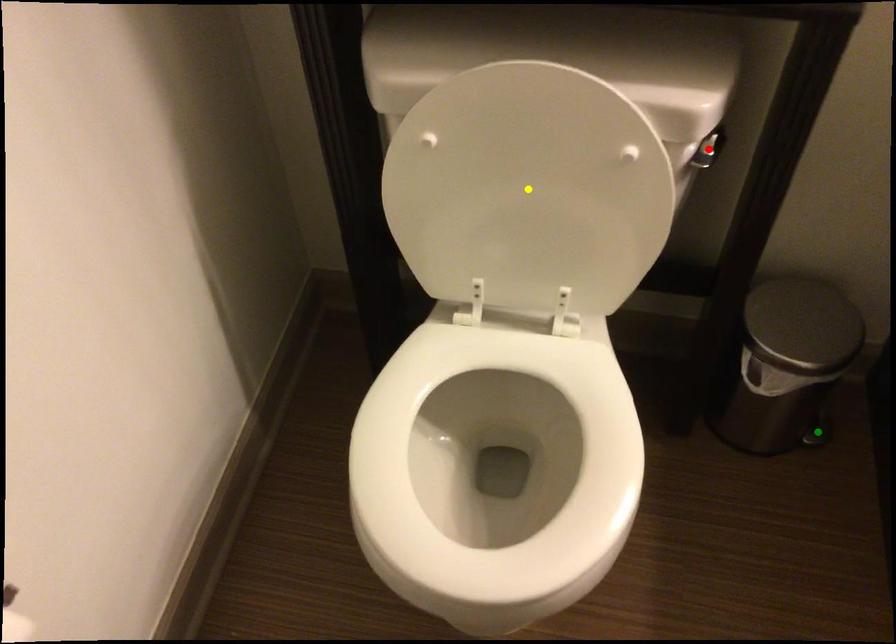
Consider the image. Order these from nearest to farthest:
1. yellow point
2. green point
3. red point

1. yellow point
2. red point
3. green point